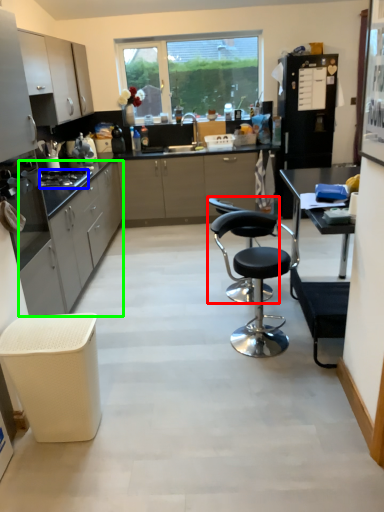
Question: Which object is the closest to the chair (highlighted by a red box)? Choose among these: gas stove (highlighted by a blue box) or cabinetry (highlighted by a green box).

Choices:
 (A) gas stove
 (B) cabinetry

Answer: (B)